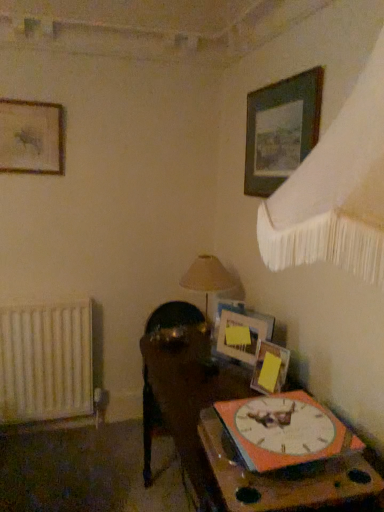
Question: Should I look upward or downward to see matte wooden picture frame at upper right, arranged as the 3th picture frame when viewed from the top?

Choices:
 (A) down
 (B) up

Answer: (A)

Question: Is wooden table at lower right, which ranks as the first table in bottom-to-top order, positioned with its back to wooden clock at lower right, which is counted as the 1th table, starting from the top?

Choices:
 (A) yes
 (B) no

Answer: (B)

Question: Considering the relative sizes of wooden table at lower right, which ranks as the first table in bottom-to-top order, and wooden clock at lower right, acting as the 2th table starting from the bottom, in the image provided, is wooden table at lower right, which ranks as the first table in bottom-to-top order, smaller than wooden clock at lower right, acting as the 2th table starting from the bottom,?

Choices:
 (A) no
 (B) yes

Answer: (A)

Question: Does wooden table at lower right, the 2th table positioned from the top, have a lesser height compared to wooden clock at lower right, which is counted as the 1th table, starting from the top?

Choices:
 (A) yes
 (B) no

Answer: (B)

Question: Does wooden table at lower right, which ranks as the first table in bottom-to-top order, turn towards wooden clock at lower right, which is counted as the 1th table, starting from the top?

Choices:
 (A) yes
 (B) no

Answer: (B)

Question: From the image's perspective, would you say wooden table at lower right, which ranks as the first table in bottom-to-top order, is shown under wooden clock at lower right, which is counted as the 1th table, starting from the top?

Choices:
 (A) no
 (B) yes

Answer: (B)

Question: Does wooden table at lower right, which ranks as the first table in bottom-to-top order, have a larger size compared to wooden clock at lower right, acting as the 2th table starting from the bottom?

Choices:
 (A) no
 (B) yes

Answer: (B)

Question: From a real-world perspective, is wooden picture frame at upper right, the third picture frame in the bottom-to-top sequence, positioned over white matte radiator at left based on gravity?

Choices:
 (A) yes
 (B) no

Answer: (A)

Question: Considering the relative sizes of wooden picture frame at upper right, the third picture frame in the bottom-to-top sequence, and white matte radiator at left in the image provided, is wooden picture frame at upper right, the third picture frame in the bottom-to-top sequence, taller than white matte radiator at left?

Choices:
 (A) yes
 (B) no

Answer: (B)

Question: Is wooden picture frame at upper right, which is the fourth picture frame from left to right, facing away from white matte radiator at left?

Choices:
 (A) yes
 (B) no

Answer: (B)

Question: Is wooden picture frame at upper right, the third picture frame in the bottom-to-top sequence, next to white matte radiator at left and touching it?

Choices:
 (A) no
 (B) yes

Answer: (A)

Question: Considering the relative positions of wooden picture frame at upper right, the third picture frame in the bottom-to-top sequence, and white matte radiator at left in the image provided, is wooden picture frame at upper right, the third picture frame in the bottom-to-top sequence, to the right of white matte radiator at left from the viewer's perspective?

Choices:
 (A) no
 (B) yes

Answer: (B)

Question: From the image's perspective, is wooden picture frame at upper right, which is the fourth picture frame from left to right, below white matte radiator at left?

Choices:
 (A) yes
 (B) no

Answer: (B)

Question: From the image's perspective, is white matte radiator at left on top of beige fabric lampshade at center?

Choices:
 (A) yes
 (B) no

Answer: (B)